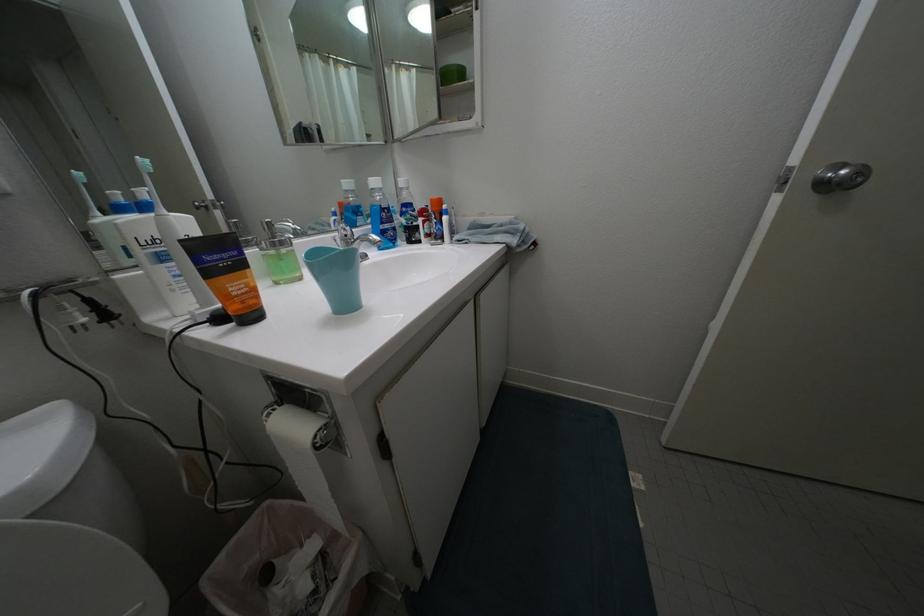
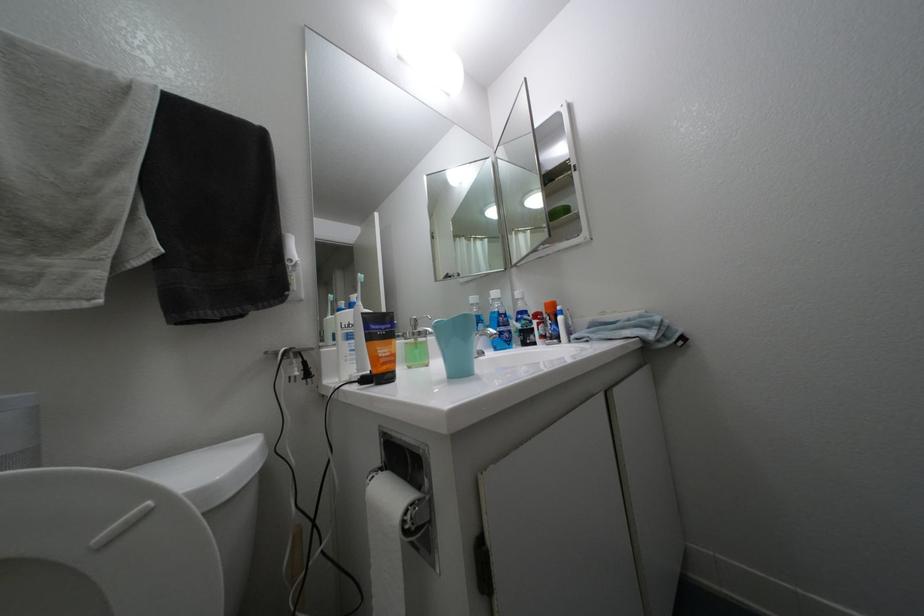
Based on the continuous images, in which direction is the camera rotating?

The camera rotated toward left-up.